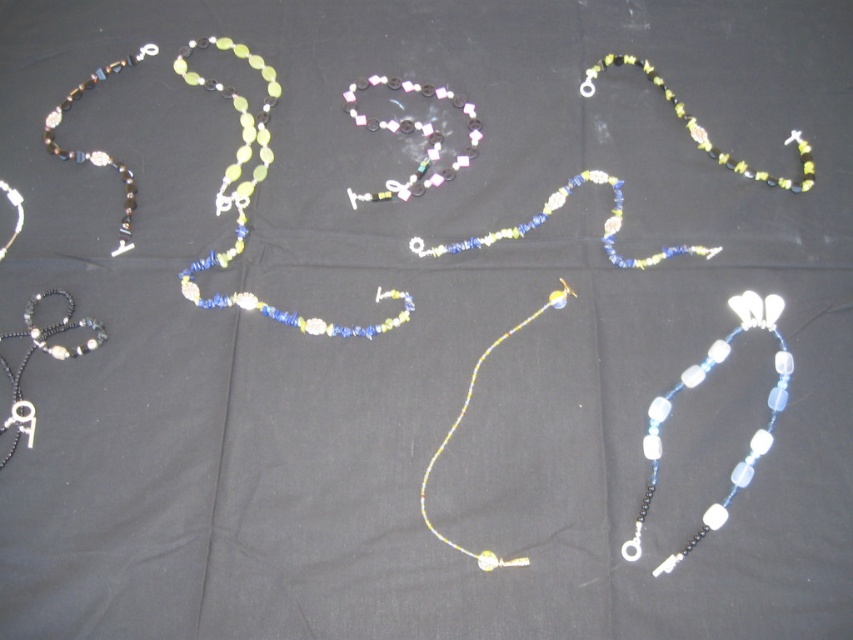
You are a jewelry designer examining the necklaces. You need to determine which beads are wider for a new design. Which beads are wider between the translucent yellow glass beads at center and the matte black beads at upper left?

The translucent yellow glass beads at center are wider than the matte black beads at upper left.

You are an artisan examining the beaded necklaces arranged on the black fabric. You notice a specific point marked at coordinates point (250, 196). What type of bead is located at this point?

The translucent yellow glass beads at center is located at point (250, 196).